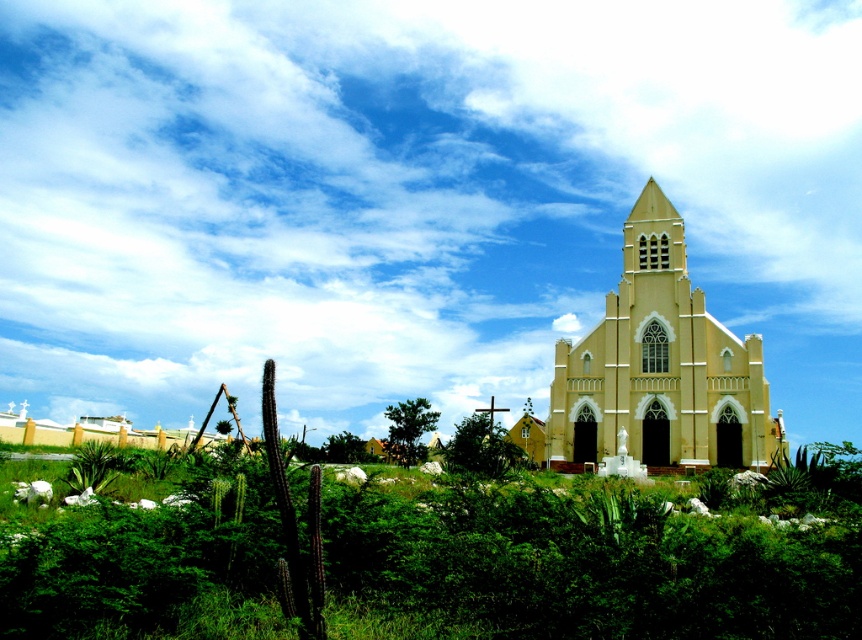
You are standing in front of the church and notice the white fluffy cloud at upper center and the green leafy shrubs at center. Which object is positioned to the right side of the other?

The white fluffy cloud at upper center is to the right of green leafy shrubs at center.

You are a landscape architect planning to install a new water feature between the white fluffy cloud at upper center and the green leafy shrubs at center. Given their distance apart, can you estimate if the water feature, which requires a minimum of 50 meters of space, will fit comfortably?

The distance between the white fluffy cloud at upper center and the green leafy shrubs at center is 56.91 meters, which exceeds the required 50 meters. Therefore, the water feature can be comfortably installed between them with sufficient space.

You are standing in front of the yellow matte church at center and the green leafy bush at center. Which object is closer to you?

The yellow matte church at center is closer to you because it is in front of the green leafy bush at center.